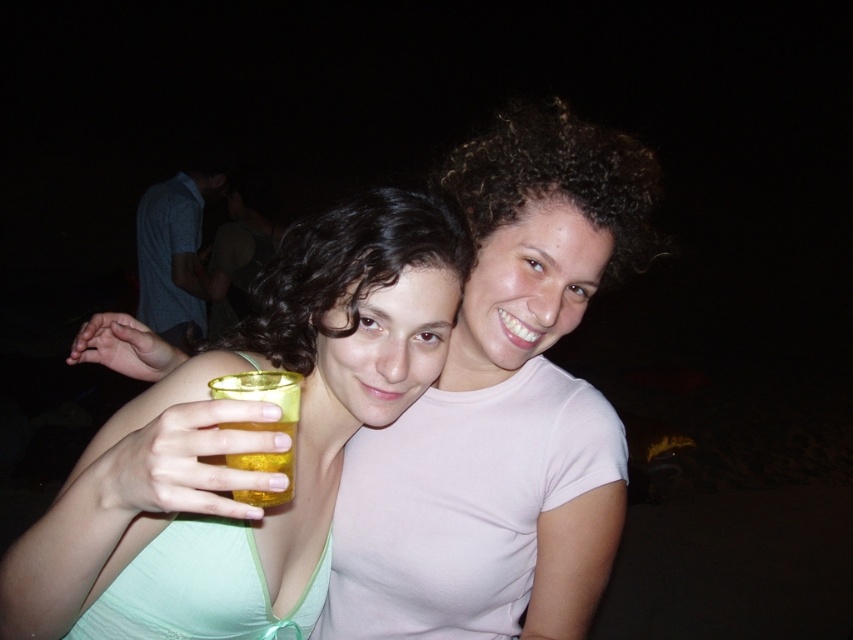
You are a photographer at a party and need to adjust the lighting between the dark curly hair at upper center and the blue cotton shirt at upper left. Since the distance between them is 6.79 feet, what is the minimum distance you should set your lighting equipment to cover both subjects adequately?

The minimum distance your lighting equipment should cover is at least 6.79 feet to ensure both the dark curly hair at upper center and the blue cotton shirt at upper left are adequately lit.

You are at a nighttime event and see the matte pink shirt at center. Where exactly is it positioned in the image?

The matte pink shirt at center is located at point coordinates of 0.639 on the x axis and 0.590 on the y axis.

You are at a party and want to take a photo of the blue cotton shirt at upper left without the dark curly hair at upper center blocking it. How should you adjust your camera angle?

Move the camera to the left side so that the blue cotton shirt at upper left is no longer behind the dark curly hair at upper center.